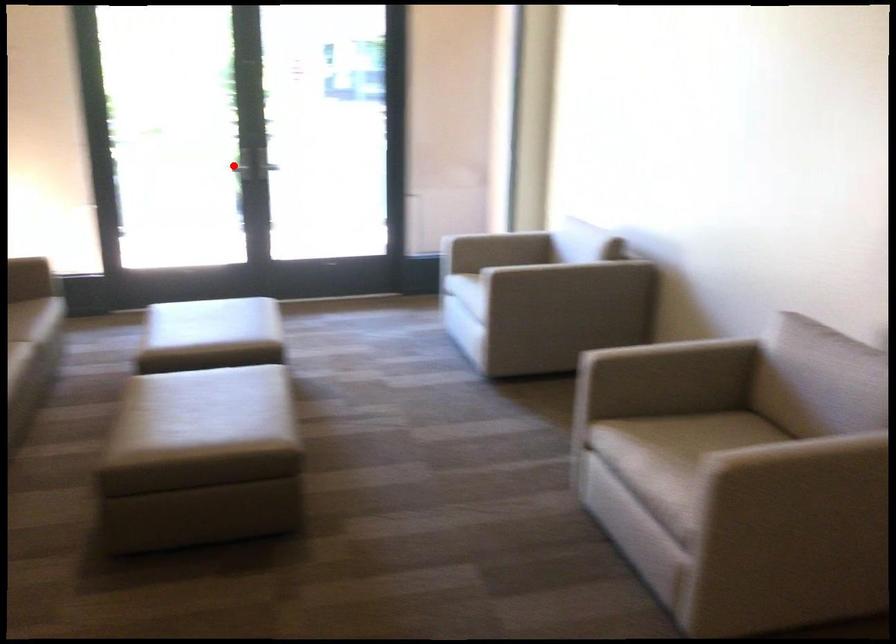
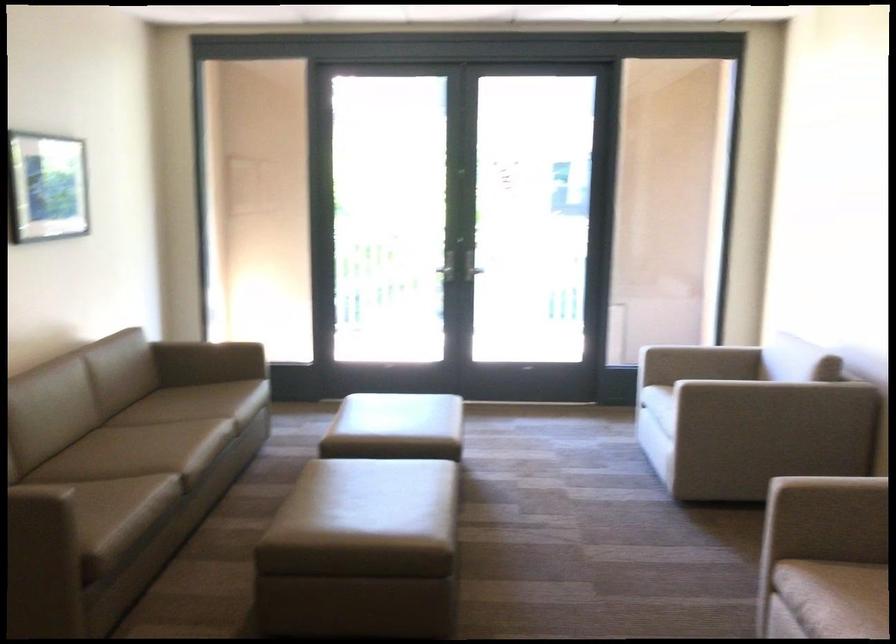
The point at the highlighted location is marked in the first image. Where is the corresponding point in the second image?

(444, 270)